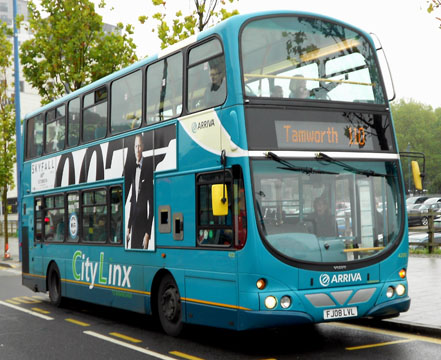
Identify the location of windows. The height and width of the screenshot is (360, 441). (106, 220).